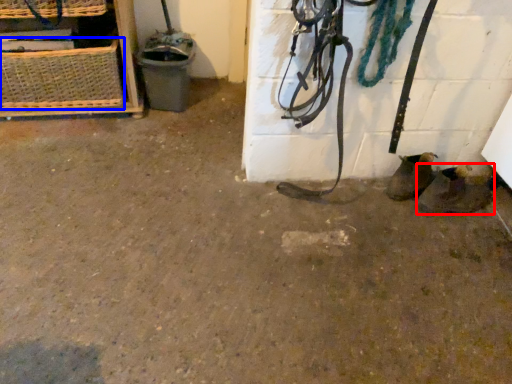
Question: Which of the following is the farthest to the observer, footwear (highlighted by a red box) or basket (highlighted by a blue box)?

Choices:
 (A) footwear
 (B) basket

Answer: (B)